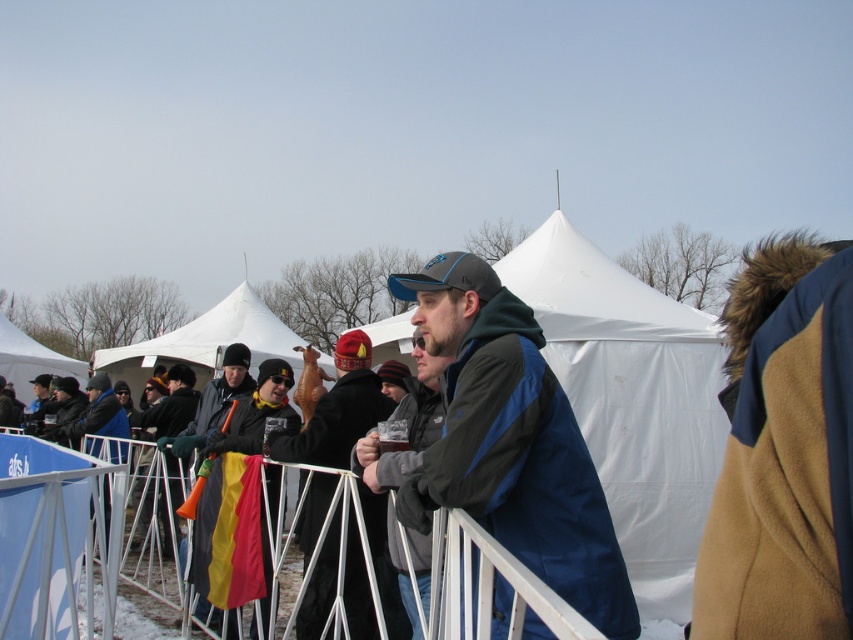
Question: Which of the following is the closest to the observer?

Choices:
 (A) white fabric canopy at center
 (B) matte black jacket at center

Answer: (B)

Question: Which point is farther to the camera?

Choices:
 (A) dark blue fleece jacket at center
 (B) white plastic fence at center
 (C) white fabric canopy at center

Answer: (C)

Question: Estimate the real-world distances between objects in this image. Which object is closer to the matte black jacket at center?

Choices:
 (A) white plastic fence at center
 (B) orange plastic megaphone at center
 (C) white fabric canopy at upper left
 (D) white fabric canopy at center

Answer: (A)

Question: Is dark blue fleece jacket at center closer to camera compared to yellow fabric flag at center?

Choices:
 (A) yes
 (B) no

Answer: (A)

Question: Can you confirm if dark blue fleece jacket at center is positioned to the left of white fabric canopy at center?

Choices:
 (A) yes
 (B) no

Answer: (B)

Question: Can you confirm if orange plastic megaphone at center is smaller than white fabric canopy at upper left?

Choices:
 (A) no
 (B) yes

Answer: (B)